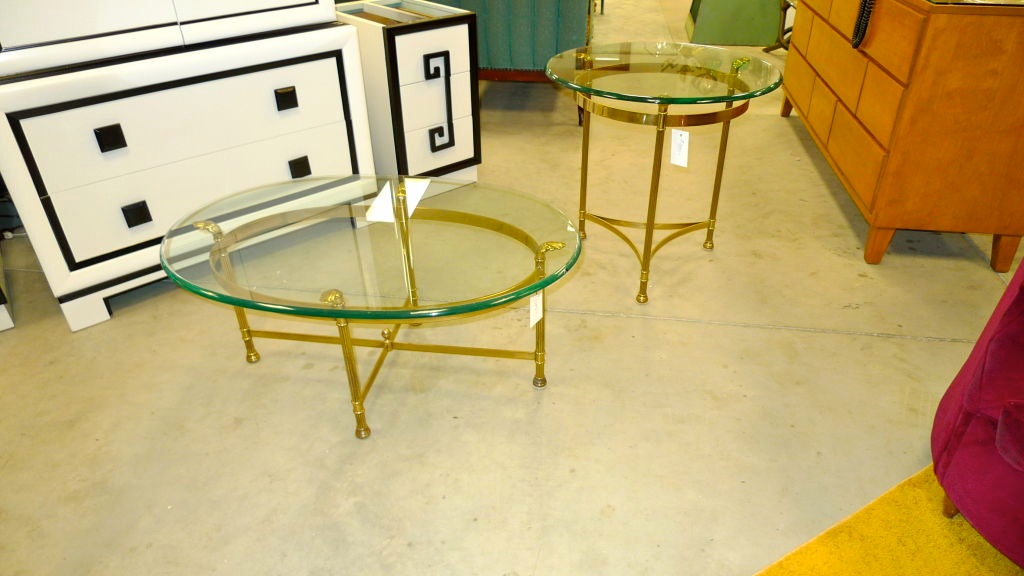
Identify the location of brass finial. (386, 332).